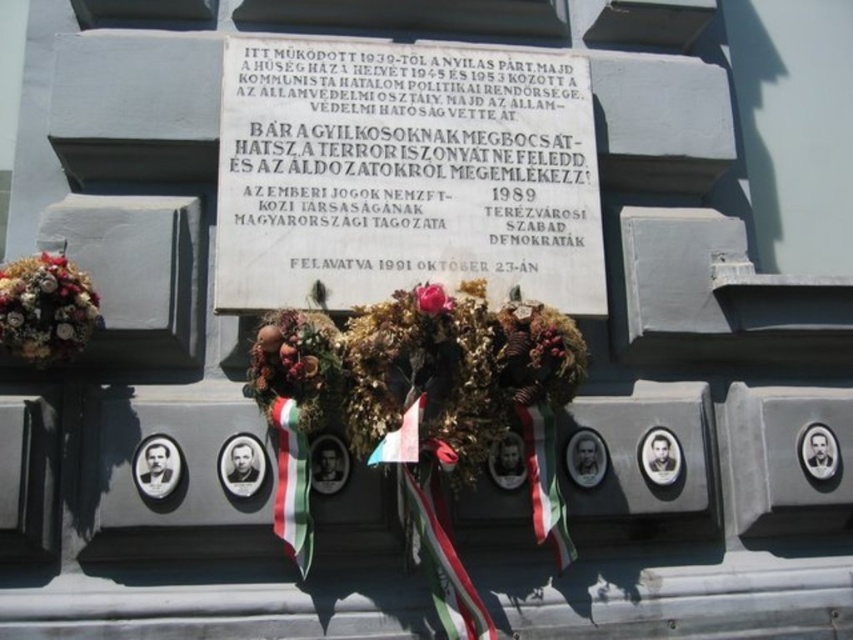
Which is more to the right, white marble plaque at center or green and white striped ribbon at center?

white marble plaque at center

Measure the distance between point [463,70] and camera.

3.71 meters

Does point (248, 93) lie behind point (306, 516)?

Yes, point (248, 93) is farther from viewer.

What are the coordinates of `white marble plaque at center` in the screenshot? It's located at (404, 173).

From the picture: Is white marble plaque at center to the right of dried floral bouquet at center from the viewer's perspective?

In fact, white marble plaque at center is to the left of dried floral bouquet at center.

Identify the location of white marble plaque at center. This screenshot has width=853, height=640. (404, 173).

Is point (236, 196) farther from camera compared to point (460, 296)?

That is True.

Where is `white marble plaque at center`? The image size is (853, 640). white marble plaque at center is located at coordinates (404, 173).

Looking at this image, between dried floral bouquet at center and matte pink rose at center, which one is positioned higher?

matte pink rose at center

Is dried floral bouquet at center above matte pink rose at center?

No, dried floral bouquet at center is not above matte pink rose at center.

Which is behind, point (260, 404) or point (430, 316)?

The point (260, 404) is behind.

Find the location of a particular element. The image size is (853, 640). dried floral bouquet at center is located at coordinates (421, 369).